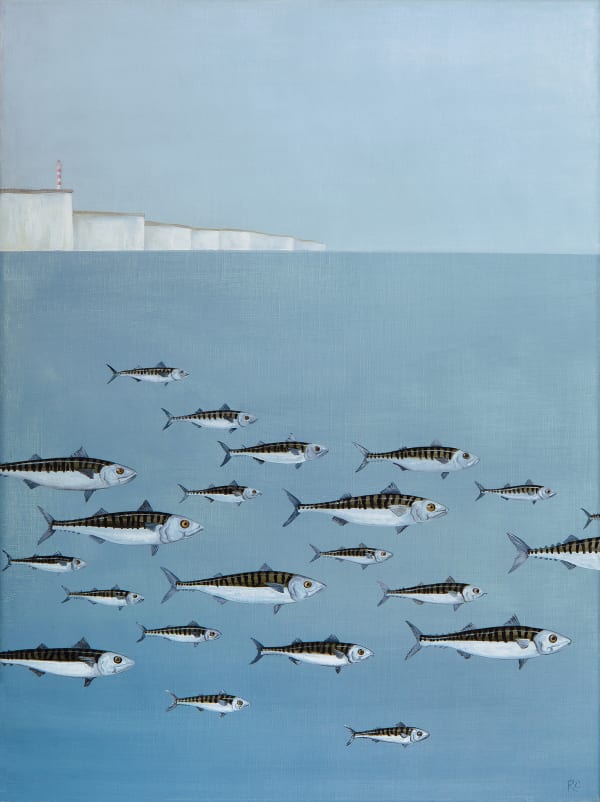
This screenshot has width=600, height=802. In order to click on white walls in this screenshot , I will do `click(35, 239)`, `click(86, 270)`, `click(102, 233)`, `click(157, 233)`, `click(207, 235)`, `click(246, 245)`.